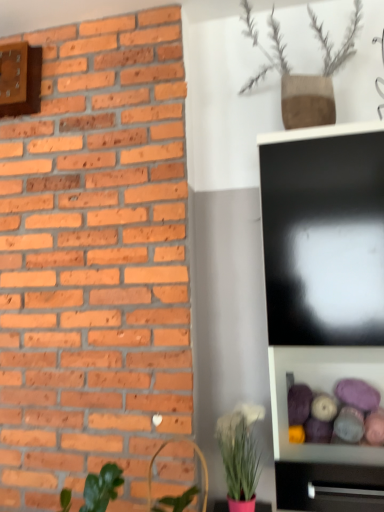
Question: From a real-world perspective, is wooden clock at upper left located higher than black glossy tv cabinet at lower right?

Choices:
 (A) no
 (B) yes

Answer: (B)

Question: Can you see wooden clock at upper left touching black glossy tv cabinet at lower right?

Choices:
 (A) yes
 (B) no

Answer: (B)

Question: Is wooden clock at upper left located outside black glossy tv cabinet at lower right?

Choices:
 (A) no
 (B) yes

Answer: (B)

Question: From a real-world perspective, is wooden clock at upper left positioned under black glossy tv cabinet at lower right based on gravity?

Choices:
 (A) yes
 (B) no

Answer: (B)

Question: Can you confirm if wooden clock at upper left is thinner than black glossy tv cabinet at lower right?

Choices:
 (A) no
 (B) yes

Answer: (B)

Question: Considering their positions, is matte pink pot at lower center, which ranks as the first houseplant in bottom-to-top order, located in front of or behind brown textured vase at upper center, which is counted as the 1th houseplant, starting from the top?

Choices:
 (A) behind
 (B) front

Answer: (B)

Question: Does point (253, 505) appear closer or farther from the camera than point (254, 36)?

Choices:
 (A) closer
 (B) farther

Answer: (A)

Question: In terms of height, does matte pink pot at lower center, which ranks as the first houseplant in bottom-to-top order, look taller or shorter compared to brown textured vase at upper center, which is counted as the 1th houseplant, starting from the top?

Choices:
 (A) tall
 (B) short

Answer: (B)

Question: Considering the positions of matte pink pot at lower center, marked as the 2th houseplant in a top-to-bottom arrangement, and brown textured vase at upper center, which is counted as the 1th houseplant, starting from the top, in the image, is matte pink pot at lower center, marked as the 2th houseplant in a top-to-bottom arrangement, wider or thinner than brown textured vase at upper center, which is counted as the 1th houseplant, starting from the top,?

Choices:
 (A) thin
 (B) wide

Answer: (B)

Question: Does point (301, 93) appear closer or farther from the camera than point (289, 498)?

Choices:
 (A) farther
 (B) closer

Answer: (A)

Question: From a real-world perspective, relative to black glossy tv cabinet at lower right, is brown textured vase at upper center, which is counted as the 1th houseplant, starting from the top, vertically above or below?

Choices:
 (A) below
 (B) above

Answer: (B)

Question: In terms of width, does brown textured vase at upper center, which is the 2th houseplant from bottom to top, look wider or thinner when compared to black glossy tv cabinet at lower right?

Choices:
 (A) thin
 (B) wide

Answer: (B)

Question: Is brown textured vase at upper center, which is the 2th houseplant from bottom to top, situated inside black glossy tv cabinet at lower right or outside?

Choices:
 (A) inside
 (B) outside

Answer: (B)

Question: In the image, is black glossy tv cabinet at lower right on the left side or the right side of matte pink pot at lower center, which ranks as the first houseplant in bottom-to-top order?

Choices:
 (A) right
 (B) left

Answer: (A)

Question: In terms of height, does black glossy tv cabinet at lower right look taller or shorter compared to matte pink pot at lower center, which ranks as the first houseplant in bottom-to-top order?

Choices:
 (A) tall
 (B) short

Answer: (B)